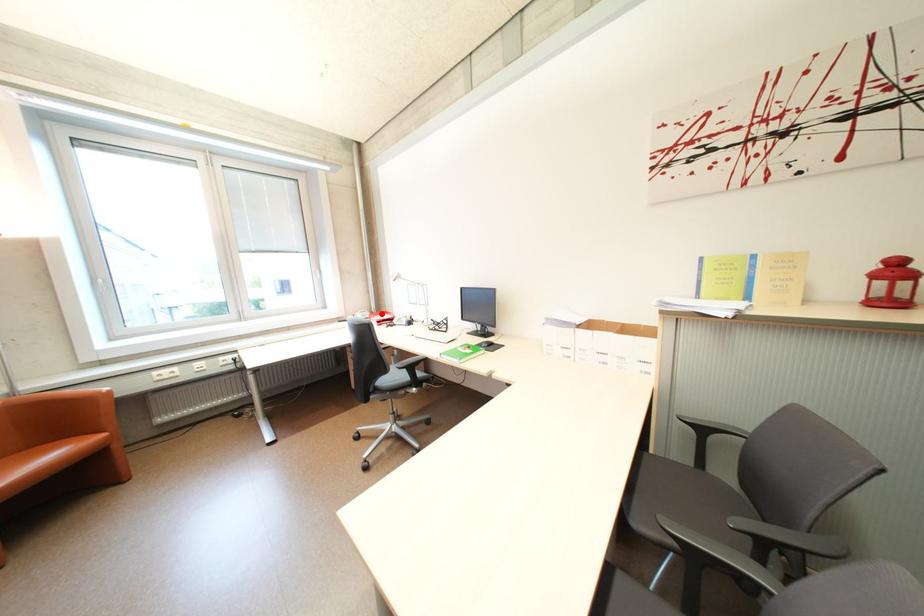
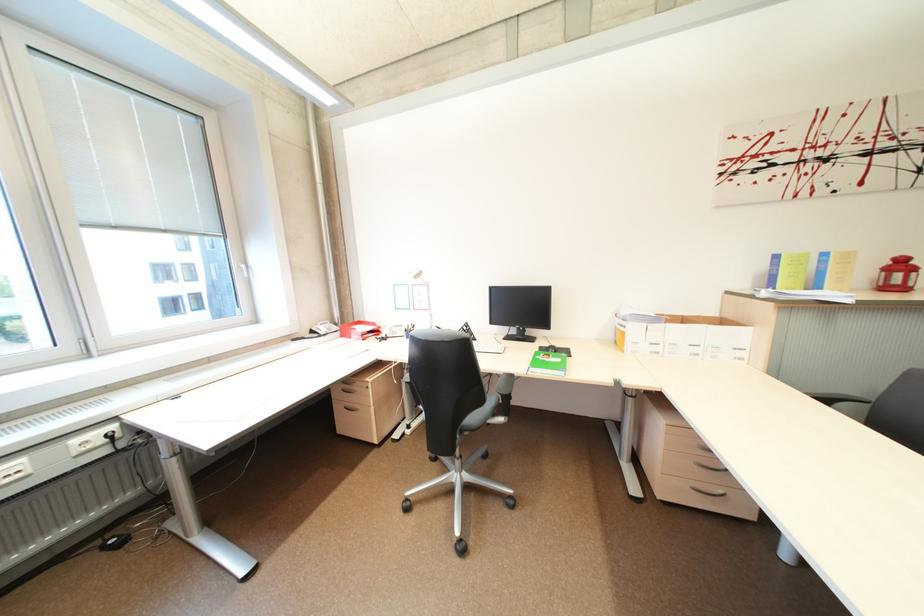
Where in the second image is the point corresponding to the highlighted location from the first image?

(345, 325)